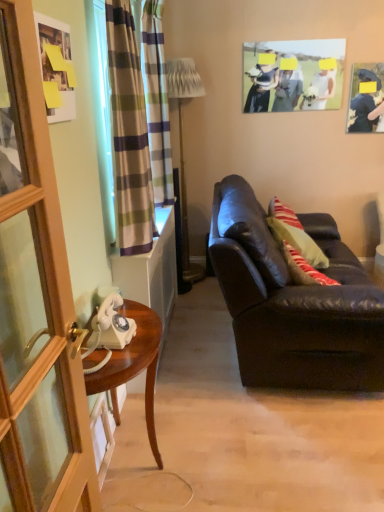
Identify the location of blank space situated above wooden desk at left (from a real-world perspective). (130, 343).